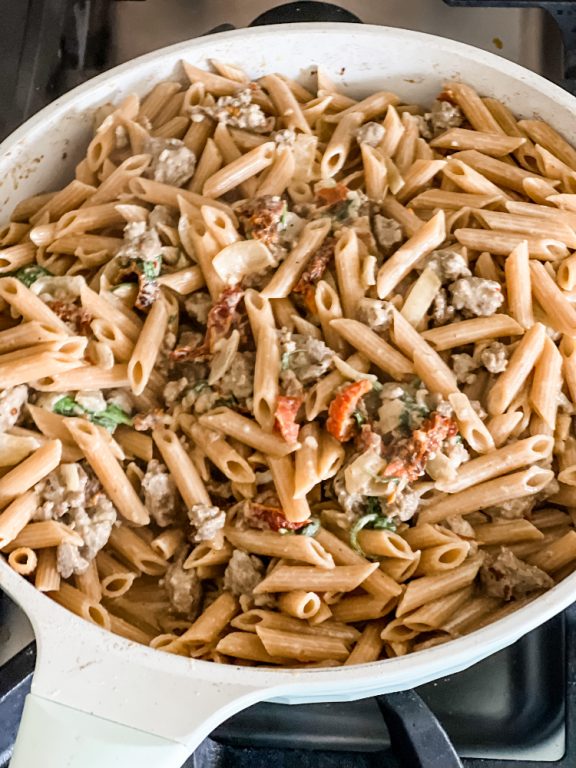
Identify the location of stove burner. The image size is (576, 768). (408, 720).